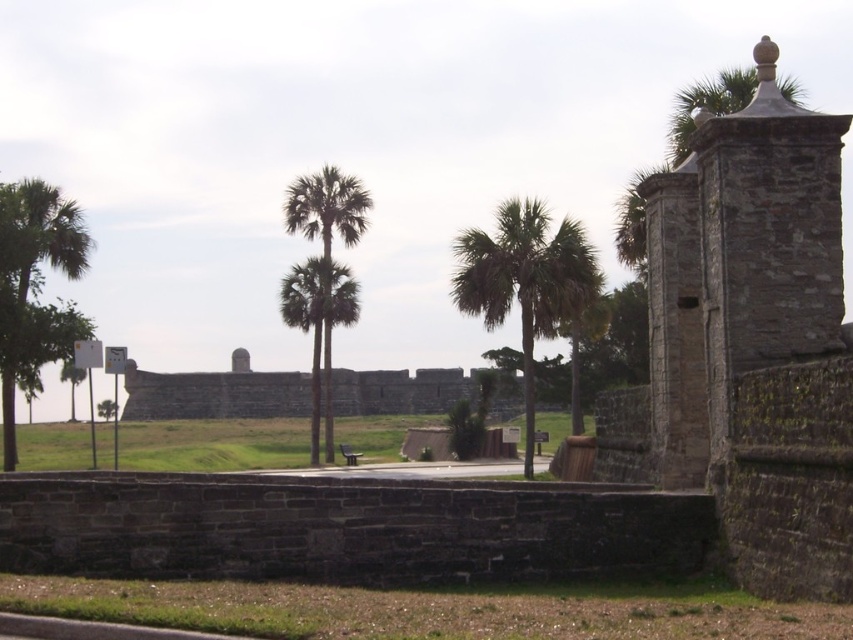
You are a landscape architect designing a garden path that must pass between the green leafy palm tree at center and the green leafy palm trees at center. Based on their widths, which palm tree group should the path be closer to to ensure it doesn not get blocked by their canopies?

Answer: The green leafy palm tree at center is narrower than the green leafy palm trees at center, so the path should be closer to the single green leafy palm tree at center to avoid obstruction from the wider canopy of the group.

Consider the image. You are standing at the entrance of the historical stone structure and want to take a photo of the green leafy palm tree at center. Which direction should you face to ensure the tree is in the frame?

The green leafy palm tree at center is located at point coordinates of [525,280], so you should face towards the center of the scene to capture it in your photo.

You are a gardener who needs to water the green leafy palm tree at left and the green leafy palm trees at center. If your watering can holds enough water for 100 feet of travel, can you water both without refilling?

The distance between the green leafy palm tree at left and the green leafy palm trees at center is 93.17 feet. Since this distance is less than 100 feet, you can water both without needing to refill your watering can.